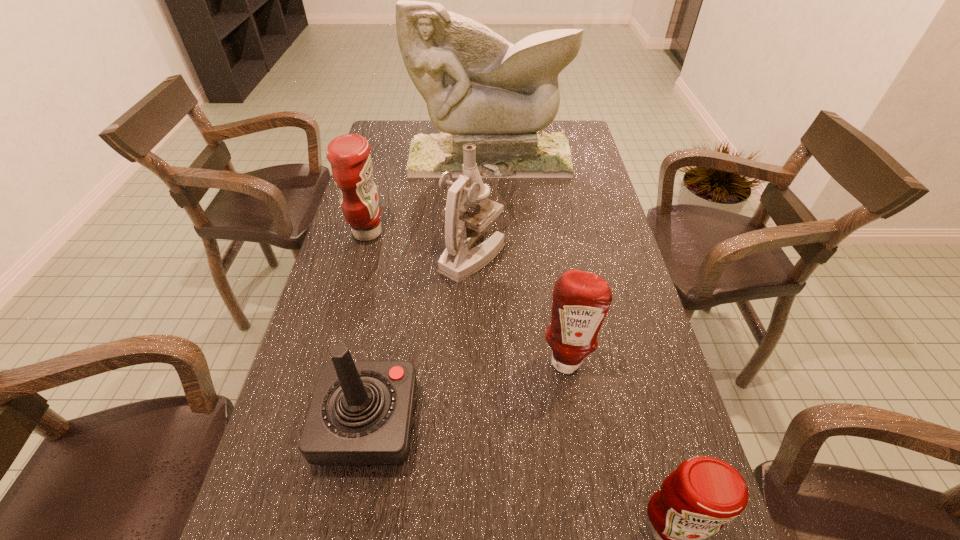
The height and width of the screenshot is (540, 960). In order to click on the farthest object in this screenshot , I will do `click(480, 89)`.

Where is `sculpture`? sculpture is located at coordinates (480, 89).

Locate an element on the screen. microscope is located at coordinates (463, 228).

Where is `the farthest condiment`? The width and height of the screenshot is (960, 540). the farthest condiment is located at coordinates (349, 155).

Locate an element on the screen. The image size is (960, 540). the third nearest object is located at coordinates (581, 300).

I want to click on the second nearest condiment, so click(x=581, y=300).

Find the location of a particular element. The height and width of the screenshot is (540, 960). the fifth farthest object is located at coordinates (361, 412).

Locate an element on the screen. Image resolution: width=960 pixels, height=540 pixels. vacant area situated 0.090m on the base of the farthest object is located at coordinates (491, 193).

Where is `vacant space situated on the right of the microscope`? vacant space situated on the right of the microscope is located at coordinates (527, 255).

Where is `vacant region located on the front of the leftmost condiment`? Image resolution: width=960 pixels, height=540 pixels. vacant region located on the front of the leftmost condiment is located at coordinates (352, 289).